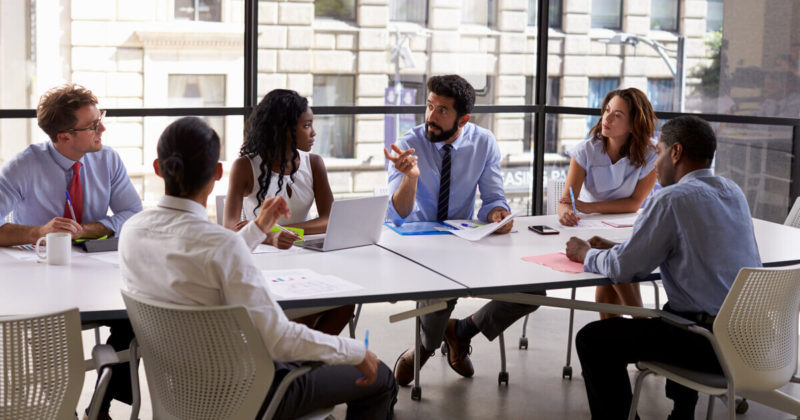
Where is `chair`? The width and height of the screenshot is (800, 420). chair is located at coordinates (734, 333), (790, 211), (574, 287), (420, 361), (182, 370), (226, 197), (52, 334), (97, 331).